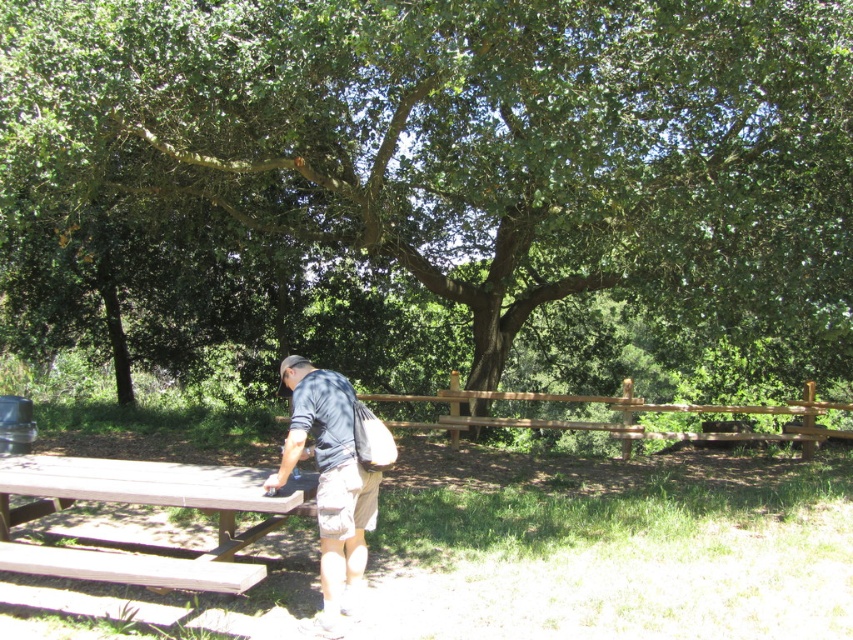
You are planning to set up a picnic blanket between the green leafy tree at center and the brown wood picnic table at lower left. Based on their positions, which side of the picnic table should you place the blanket to ensure it is between the two objects?

Result: The green leafy tree at center is to the right of the brown wood picnic table at lower left, so placing the picnic blanket to the right side of the brown wood picnic table at lower left would position it between the two objects.

You are a photographer wanting to capture the brown wood picnic table at lower left and the dark blue shirt at center in the same frame. Which object should you focus on first to ensure both are in focus?

The brown wood picnic table at lower left is in front of the dark blue shirt at center, so you should focus on the brown wood picnic table at lower left first to ensure both are in focus.

You are standing at the picnic table and want to find the green leafy tree at center. According to the coordinates provided, in which direction should you look to see it?

The green leafy tree at center is located at coordinates point (x=434, y=189). Since the coordinate system is not specified, it is difficult to determine the exact direction without additional information about the coordinate system used.